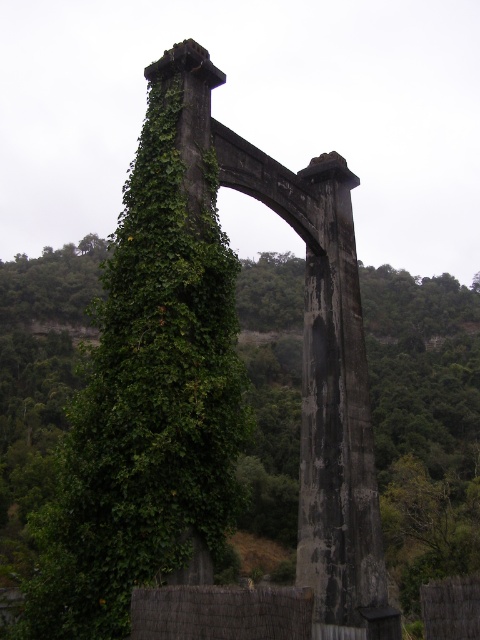
Can you confirm if green leafy ivy at center is bigger than dark gray concrete pillar at center?

Correct, green leafy ivy at center is larger in size than dark gray concrete pillar at center.

Is point (425, 417) positioned behind point (336, 397)?

Yes, it is.

The width and height of the screenshot is (480, 640). Find the location of `green leafy ivy at center`. green leafy ivy at center is located at coordinates (423, 422).